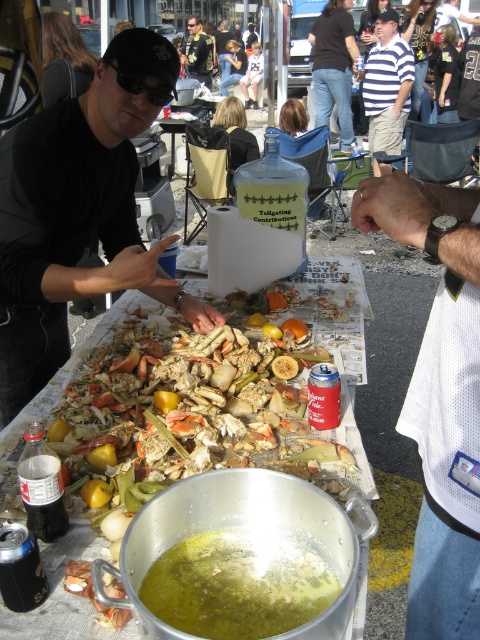
Question: Which of these objects is positioned closest to the striped cotton shirt at upper center?

Choices:
 (A) striped cotton shirt at center
 (B) white mesh shirt at center
 (C) shiny gold jacket at center

Answer: (A)

Question: Which object is the closest to the black rubber goggles at upper left?

Choices:
 (A) shiny gold jacket at center
 (B) striped cotton shirt at center
 (C) green matte soup at center

Answer: (C)

Question: Is shiny gold jacket at center smaller than black rubber goggles at upper left?

Choices:
 (A) no
 (B) yes

Answer: (A)

Question: Does black matte shirt at upper left have a larger size compared to striped cotton shirt at center?

Choices:
 (A) yes
 (B) no

Answer: (B)

Question: Is black matte shirt at upper left positioned in front of striped cotton shirt at upper center?

Choices:
 (A) no
 (B) yes

Answer: (B)

Question: Estimate the real-world distances between objects in this image. Which object is farther from the striped cotton shirt at upper center?

Choices:
 (A) black matte shirt at upper left
 (B) shiny gold jacket at center
 (C) black rubber goggles at upper left
 (D) green matte soup at center

Answer: (D)